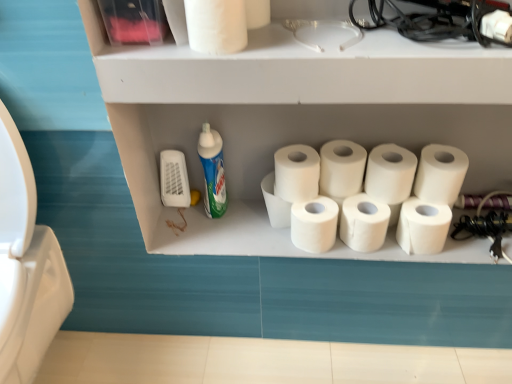
This screenshot has height=384, width=512. Find the location of `vacant space situated on the left part of white matte toilet paper at upper right, placed as the 10th toilet paper when sorted from left to right`. vacant space situated on the left part of white matte toilet paper at upper right, placed as the 10th toilet paper when sorted from left to right is located at coordinates (420, 31).